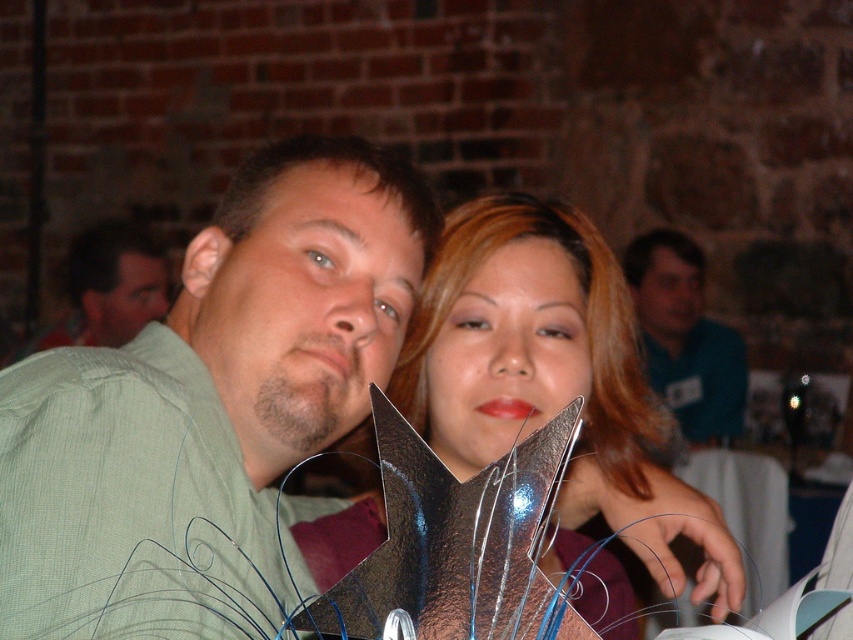
Can you confirm if blue shirt at upper right is positioned above matte green shirt at center?

Actually, blue shirt at upper right is below matte green shirt at center.

Between point (723, 401) and point (126, 300), which one is positioned in front?

Point (723, 401)

Identify the location of blue shirt at upper right. coord(685,339).

Which of these two, green matte shirt at left or matte green shirt at center, stands taller?

Standing taller between the two is matte green shirt at center.

Does green matte shirt at left appear on the right side of matte green shirt at center?

Indeed, green matte shirt at left is positioned on the right side of matte green shirt at center.

The height and width of the screenshot is (640, 853). What do you see at coordinates (209, 408) in the screenshot?
I see `green matte shirt at left` at bounding box center [209, 408].

Identify the location of green matte shirt at left. Image resolution: width=853 pixels, height=640 pixels. (209, 408).

Is point (294, 262) more distant than point (558, 406)?

That is False.

Which is behind, point (42, 548) or point (563, 321)?

The point (563, 321) is more distant.

At what (x,y) coordinates should I click in order to perform the action: click on green matte shirt at left. Please return your answer as a coordinate pair (x, y). The width and height of the screenshot is (853, 640). Looking at the image, I should click on [209, 408].